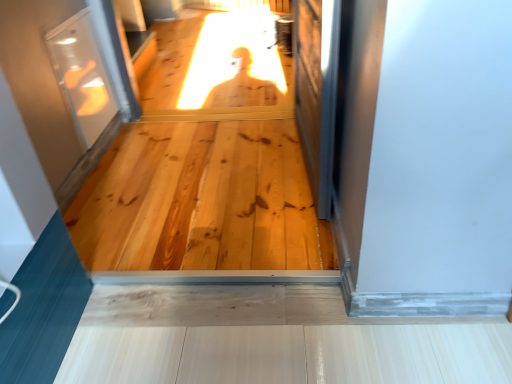
This screenshot has height=384, width=512. What do you see at coordinates (201, 201) in the screenshot? I see `natural wood flooring at center` at bounding box center [201, 201].

What do you see at coordinates (309, 90) in the screenshot? The image size is (512, 384). I see `transparent glass screen door at right, the first screen door from the right` at bounding box center [309, 90].

Locate an element on the screen. This screenshot has height=384, width=512. natural wood flooring at center is located at coordinates (201, 201).

Is transparent glass screen door at right, the second screen door viewed from the left, oriented away from clear glass screen door at upper left, the second screen door viewed from the right?

No, clear glass screen door at upper left, the second screen door viewed from the right, is not at the back of transparent glass screen door at right, the second screen door viewed from the left.

From a real-world perspective, is transparent glass screen door at right, the first screen door from the right, on top of clear glass screen door at upper left, the 1th screen door when ordered from left to right?

Correct, in the physical world, transparent glass screen door at right, the first screen door from the right, is higher than clear glass screen door at upper left, the 1th screen door when ordered from left to right.

Considering the relative sizes of transparent glass screen door at right, the first screen door from the right, and clear glass screen door at upper left, the 1th screen door when ordered from left to right, in the image provided, is transparent glass screen door at right, the first screen door from the right, smaller than clear glass screen door at upper left, the 1th screen door when ordered from left to right,?

No, transparent glass screen door at right, the first screen door from the right, is not smaller than clear glass screen door at upper left, the 1th screen door when ordered from left to right.

What's the angular difference between transparent glass screen door at right, the second screen door viewed from the left, and clear glass screen door at upper left, the second screen door viewed from the right,'s facing directions?

178 degrees separate the facing orientations of transparent glass screen door at right, the second screen door viewed from the left, and clear glass screen door at upper left, the second screen door viewed from the right.

Is clear glass screen door at upper left, the 1th screen door when ordered from left to right, situated inside transparent glass screen door at right, the first screen door from the right, or outside?

clear glass screen door at upper left, the 1th screen door when ordered from left to right, is not inside transparent glass screen door at right, the first screen door from the right, it's outside.

Is clear glass screen door at upper left, the second screen door viewed from the right, wider than transparent glass screen door at right, the first screen door from the right?

In fact, clear glass screen door at upper left, the second screen door viewed from the right, might be narrower than transparent glass screen door at right, the first screen door from the right.

Which object is positioned more to the right, clear glass screen door at upper left, the second screen door viewed from the right, or transparent glass screen door at right, the second screen door viewed from the left?

Positioned to the right is transparent glass screen door at right, the second screen door viewed from the left.

Is transparent glass screen door at right, the first screen door from the right, taller than natural wood flooring at center?

Correct, transparent glass screen door at right, the first screen door from the right, is much taller as natural wood flooring at center.

Considering the positions of points (316, 94) and (281, 163), is point (316, 94) closer to camera compared to point (281, 163)?

Yes, it is in front of point (281, 163).

From the image's perspective, is transparent glass screen door at right, the first screen door from the right, on natural wood flooring at center?

Yes, from the image's perspective, transparent glass screen door at right, the first screen door from the right, is over natural wood flooring at center.

The image size is (512, 384). I want to click on screen door on the right of natural wood flooring at center, so click(x=309, y=90).

Is clear glass screen door at upper left, the second screen door viewed from the right, positioned behind natural wood flooring at center?

Yes, clear glass screen door at upper left, the second screen door viewed from the right, is further from the viewer.

From a real-world perspective, which is physically below, clear glass screen door at upper left, the 1th screen door when ordered from left to right, or natural wood flooring at center?

In real-world perspective, natural wood flooring at center is lower.

Can you confirm if clear glass screen door at upper left, the second screen door viewed from the right, is shorter than natural wood flooring at center?

No, clear glass screen door at upper left, the second screen door viewed from the right, is not shorter than natural wood flooring at center.

Which is behind, point (112, 91) or point (271, 127)?

The point (271, 127) is farther from the camera.

Is natural wood flooring at center turned away from transparent glass screen door at right, the second screen door viewed from the left?

No, natural wood flooring at center is not facing away from transparent glass screen door at right, the second screen door viewed from the left.

Consider the image. From the image's perspective, which is above, natural wood flooring at center or transparent glass screen door at right, the second screen door viewed from the left?

transparent glass screen door at right, the second screen door viewed from the left.

Who is bigger, natural wood flooring at center or transparent glass screen door at right, the second screen door viewed from the left?

natural wood flooring at center.

Is there a large distance between natural wood flooring at center and transparent glass screen door at right, the first screen door from the right?

No.

Is natural wood flooring at center looking in the opposite direction of clear glass screen door at upper left, the second screen door viewed from the right?

No, natural wood flooring at center is not facing the opposite direction of clear glass screen door at upper left, the second screen door viewed from the right.

Consider the image. Is natural wood flooring at center not inside clear glass screen door at upper left, the second screen door viewed from the right?

natural wood flooring at center is positioned outside clear glass screen door at upper left, the second screen door viewed from the right.

Considering the positions of objects natural wood flooring at center and clear glass screen door at upper left, the second screen door viewed from the right, in the image provided, who is behind, natural wood flooring at center or clear glass screen door at upper left, the second screen door viewed from the right,?

clear glass screen door at upper left, the second screen door viewed from the right.

Considering the sizes of objects natural wood flooring at center and clear glass screen door at upper left, the second screen door viewed from the right, in the image provided, who is thinner, natural wood flooring at center or clear glass screen door at upper left, the second screen door viewed from the right,?

Thinner between the two is clear glass screen door at upper left, the second screen door viewed from the right.

You are a GUI agent. You are given a task and a screenshot of the screen. Output one action in this format:
    pyautogui.click(x=<x>, y=<y>)
    Task: Click on the screen door located on the right of clear glass screen door at upper left, the second screen door viewed from the right
    
    Given the screenshot: What is the action you would take?
    pyautogui.click(x=309, y=90)

In the image, there is a transparent glass screen door at right, the second screen door viewed from the left. Where is `screen door below it (from a real-world perspective)`? This screenshot has height=384, width=512. screen door below it (from a real-world perspective) is located at coordinates (82, 75).

Looking at the image, which one is located closer to transparent glass screen door at right, the first screen door from the right, natural wood flooring at center or clear glass screen door at upper left, the 1th screen door when ordered from left to right?

natural wood flooring at center lies closer to transparent glass screen door at right, the first screen door from the right, than the other object.

Which object lies further to the anchor point natural wood flooring at center, transparent glass screen door at right, the second screen door viewed from the left, or clear glass screen door at upper left, the second screen door viewed from the right?

Based on the image, clear glass screen door at upper left, the second screen door viewed from the right, appears to be further to natural wood flooring at center.

Based on their spatial positions, is clear glass screen door at upper left, the second screen door viewed from the right, or natural wood flooring at center further from transparent glass screen door at right, the first screen door from the right?

clear glass screen door at upper left, the second screen door viewed from the right.

Considering their positions, is clear glass screen door at upper left, the second screen door viewed from the right, positioned closer to natural wood flooring at center than transparent glass screen door at right, the first screen door from the right?

transparent glass screen door at right, the first screen door from the right, is closer to natural wood flooring at center.

When comparing their distances from clear glass screen door at upper left, the 1th screen door when ordered from left to right, does transparent glass screen door at right, the first screen door from the right, or natural wood flooring at center seem closer?

Based on the image, natural wood flooring at center appears to be nearer to clear glass screen door at upper left, the 1th screen door when ordered from left to right.

Considering their positions, is natural wood flooring at center positioned further to clear glass screen door at upper left, the 1th screen door when ordered from left to right, than transparent glass screen door at right, the second screen door viewed from the left?

transparent glass screen door at right, the second screen door viewed from the left.

This screenshot has width=512, height=384. What are the coordinates of `hardwood located between clear glass screen door at upper left, the 1th screen door when ordered from left to right, and transparent glass screen door at right, the first screen door from the right, in the left-right direction` in the screenshot? It's located at (201, 201).